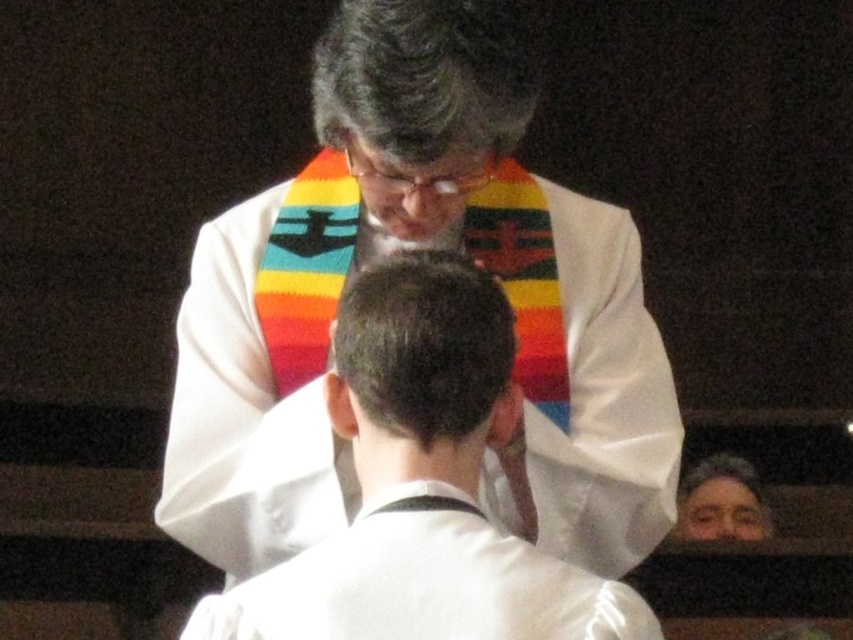
You are standing in the crowd watching the religious ceremony. You see a point marked at coordinates (x=416, y=246). Which object is this point located on?

The point at coordinates (x=416, y=246) is located on the white woolen scarf at upper center.

You are attending a religious ceremony and notice two items of clothing. The first is a white woolen scarf at upper center, and the second is a white satin robe at center. Which item is positioned higher in the image?

The white woolen scarf at upper center is taller than the white satin robe at center, so it is positioned higher in the image.

You are a photographer trying to capture a closeup shot of the brown hair at center during the ceremony. However, there is a white woolen scarf at upper center in the way. Based on the distance between them, can you estimate whether the scarf will block the view of the hair if you focus on the hair?

The distance between the white woolen scarf at upper center and the brown hair at center is 13.44 inches. Since the scarf is 13.44 inches away from the hair, it might not completely block the view unless they are in the same focal plane. However, focusing on the hair should allow capturing it clearly while the scarf appears in the background.